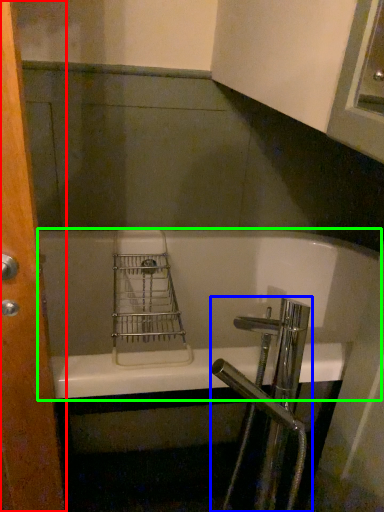
Question: Considering the real-world distances, which object is farthest from screen door (highlighted by a red box)? tap (highlighted by a blue box) or bathtub (highlighted by a green box)?

Choices:
 (A) tap
 (B) bathtub

Answer: (B)